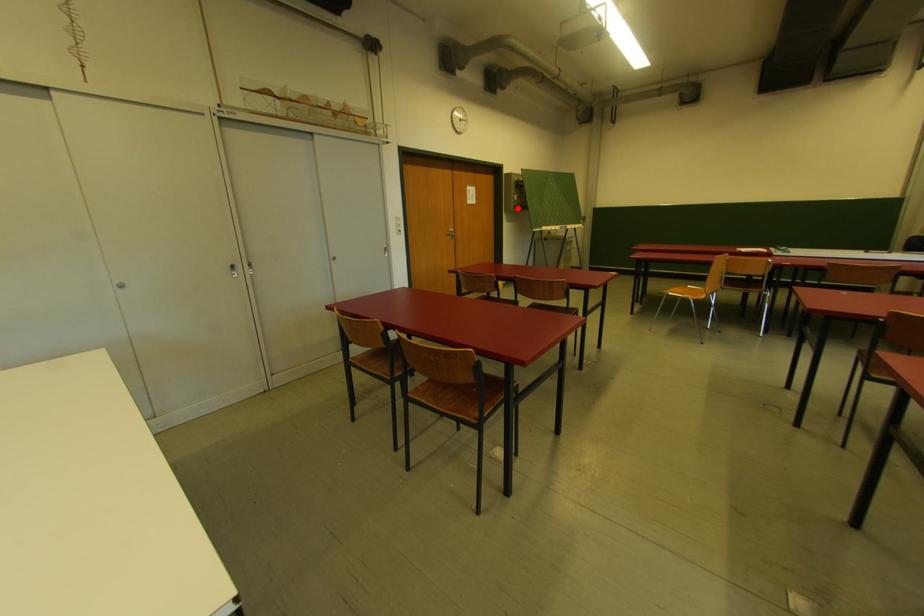
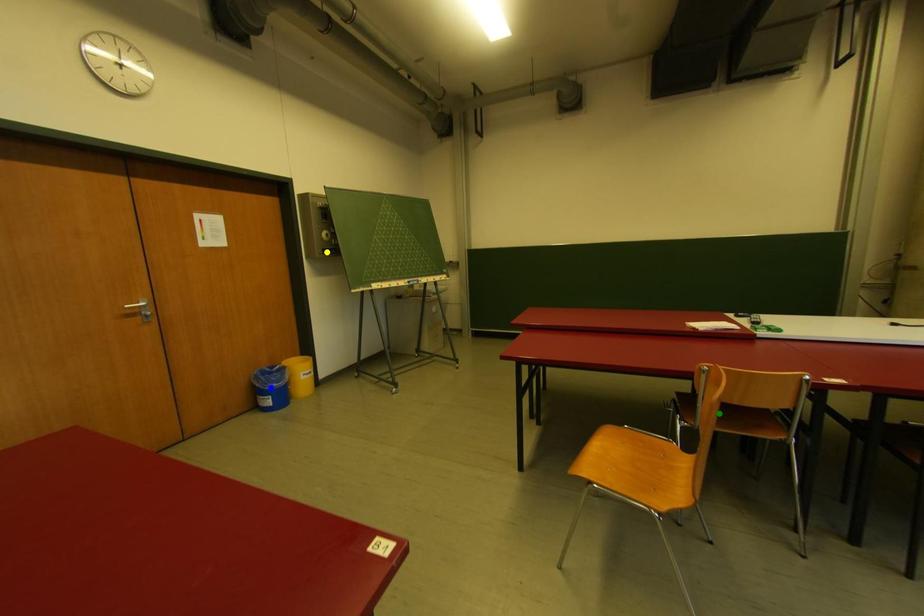
Question: I am providing you with two images of the same scene from different viewpoints. A red point is marked on the first image. You are given multiple points on the second image. In image 2, which mark is for the same physical point as the one in image 1?

Choices:
 (A) green point
 (B) blue point
 (C) yellow point

Answer: (C)